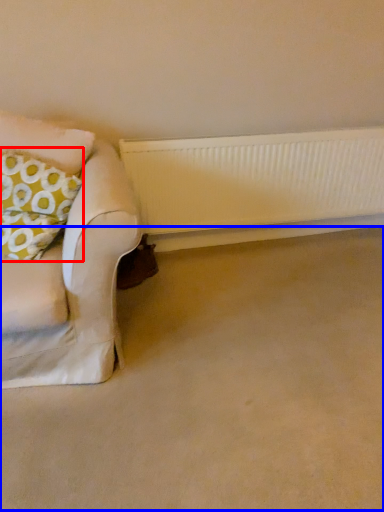
Question: Which of the following is the farthest to the observer, throw pillow (highlighted by a red box) or plain (highlighted by a blue box)?

Choices:
 (A) throw pillow
 (B) plain

Answer: (A)